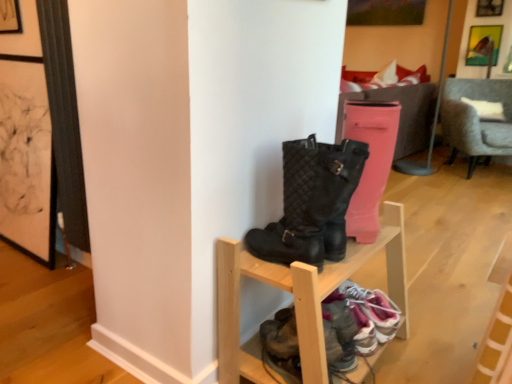
Question: From a real-world perspective, is black quilted boots at center positioned above or below gray fabric chair at right?

Choices:
 (A) below
 (B) above

Answer: (B)

Question: Is black quilted boots at center wider or thinner than gray fabric chair at right?

Choices:
 (A) thin
 (B) wide

Answer: (A)

Question: Estimate the real-world distances between objects in this image. Which object is farther from the white fabric pillow at upper center?

Choices:
 (A) pink fabric sneaker at lower right, acting as the second footwear starting from the left
 (B) black quilted boots at center
 (C) gray fabric chair at right
 (D) leather sneakers at lower center, positioned as the second footwear in right-to-left order
 (E) wooden shoe rack at center

Answer: (D)

Question: Considering the real-world distances, which object is closest to the gray fabric chair at right?

Choices:
 (A) pink fabric sneaker at lower right, placed as the 1th footwear when sorted from right to left
 (B) leather sneakers at lower center, which appears as the 1th footwear when viewed from the left
 (C) white fabric pillow at upper center
 (D) metallic gold picture frame at upper right
 (E) wooden shoe rack at center

Answer: (C)